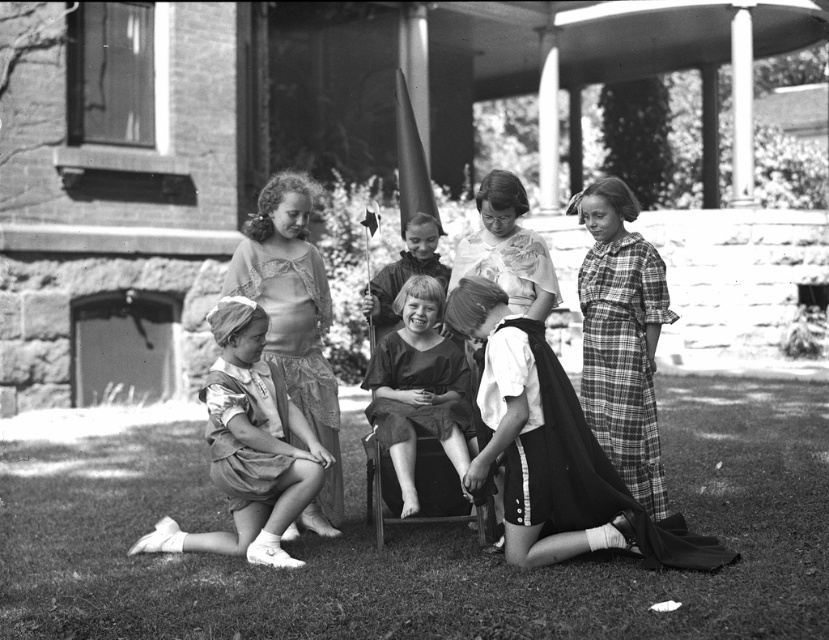
Between grassy lawn at lower center and plaid fabric dress at right, which one is positioned higher?

plaid fabric dress at right

Between grassy lawn at lower center and plaid fabric dress at right, which one has less height?

grassy lawn at lower center

Describe the element at coordinates (420, 541) in the screenshot. I see `grassy lawn at lower center` at that location.

What are the coordinates of `grassy lawn at lower center` in the screenshot? It's located at (420, 541).

Between matte white dress at lower left and dark fabric dress at center, which one appears on the right side from the viewer's perspective?

dark fabric dress at center is more to the right.

Which is more to the left, matte white dress at lower left or dark fabric dress at center?

matte white dress at lower left is more to the left.

Where is `matte white dress at lower left`? This screenshot has height=640, width=829. matte white dress at lower left is located at coordinates 250,448.

Can you confirm if matte black dress at center is positioned below smooth fabric dress at center?

Indeed, matte black dress at center is positioned under smooth fabric dress at center.

Does matte black dress at center have a smaller size compared to smooth fabric dress at center?

Incorrect, matte black dress at center is not smaller in size than smooth fabric dress at center.

Which is behind, point (306, 477) or point (527, 205)?

Positioned behind is point (527, 205).

Image resolution: width=829 pixels, height=640 pixels. I want to click on matte black dress at center, so click(257, 444).